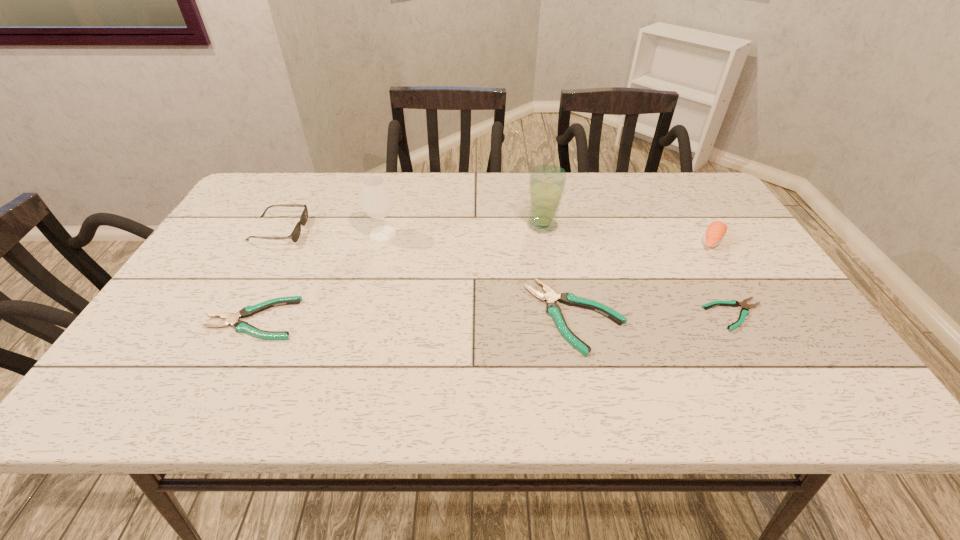
Locate an element on the screen. This screenshot has width=960, height=540. sushi present at the right edge is located at coordinates (715, 232).

Find the location of `object located at the far left corner`. object located at the far left corner is located at coordinates (295, 234).

The image size is (960, 540). Find the location of `object that is at the near left corner`. object that is at the near left corner is located at coordinates (232, 319).

The width and height of the screenshot is (960, 540). In the image, there is a desktop. What are the coordinates of `blank space at the far edge` in the screenshot? It's located at tap(657, 213).

The height and width of the screenshot is (540, 960). In the image, there is a desktop. Identify the location of vacant space at the near edge. (519, 334).

Image resolution: width=960 pixels, height=540 pixels. In order to click on free location at the left edge of the desktop in this screenshot , I will do `click(272, 237)`.

I want to click on free space at the far right corner, so click(678, 190).

This screenshot has width=960, height=540. What are the coordinates of `free spot between the leftmost pliers and the second pliers from left to right` in the screenshot? It's located at (415, 318).

The width and height of the screenshot is (960, 540). I want to click on vacant area that lies between the third tallest object and the second pliers from right to left, so click(x=644, y=279).

Locate an element on the screen. The width and height of the screenshot is (960, 540). free point between the right glass and the third object from left to right is located at coordinates (463, 230).